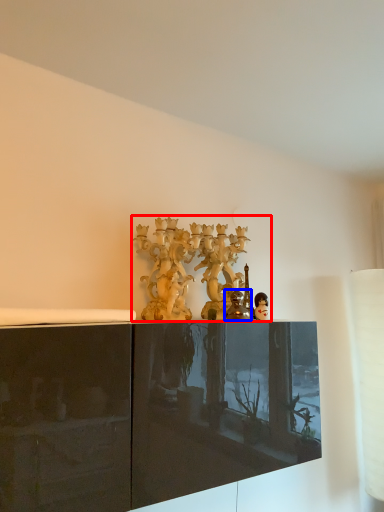
Question: Which object appears farthest to the camera in this image, collection (highlighted by a red box) or figurine (highlighted by a blue box)?

Choices:
 (A) collection
 (B) figurine

Answer: (A)